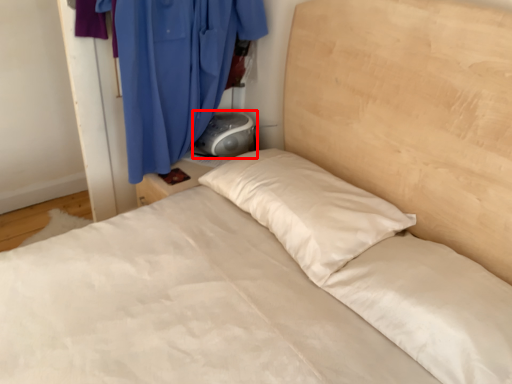
Question: From the image's perspective, considering the relative positions of gray (annotated by the red box) and curtain in the image provided, where is gray (annotated by the red box) located with respect to the staircase?

Choices:
 (A) above
 (B) below

Answer: (B)